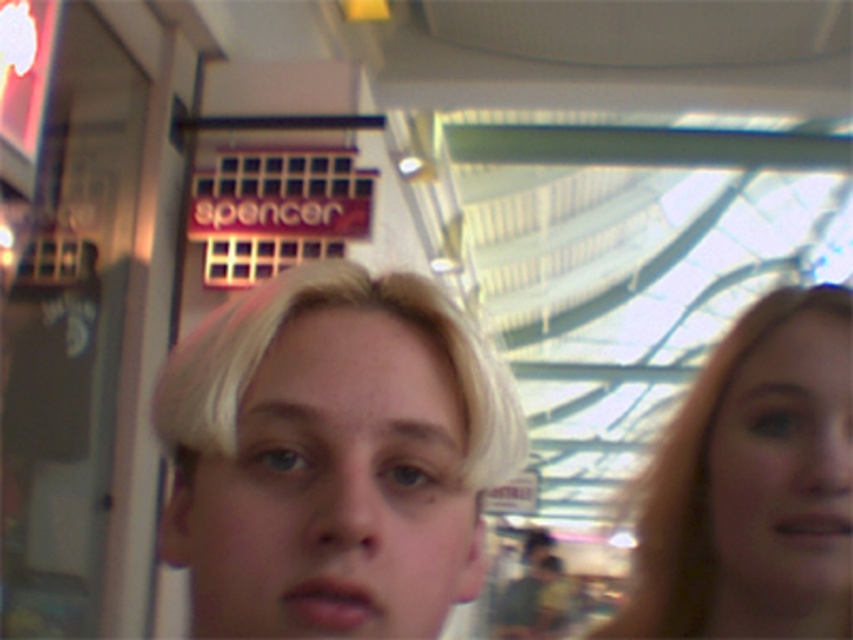
You are standing in a shopping mall and see the image. There is a point marked at coordinates (332, 456). What object in the image is located at that point?

The blonde hair at center is located at point (332, 456).

You are a photographer trying to capture both the blonde hair at center and the blonde hair at right in a single frame. Based on their sizes in the image, which one should you adjust your camera focus to prioritize for clarity?

The blonde hair at center is smaller than the blonde hair at right, so you should prioritize focusing on the blonde hair at right since it appears larger and might be closer to the camera, ensuring it remains clear in the photo.

You are standing in a shopping mall and see the image. You want to locate the blonde hair at center. Where is it located in terms of coordinates?

The blonde hair at center is located at coordinates point (332, 456).